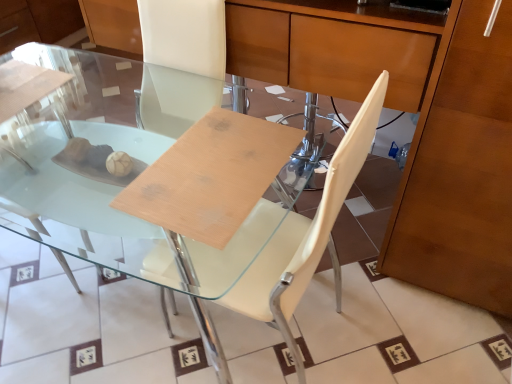
Question: Can you confirm if white leather chair at center is shorter than transparent glass table at center?

Choices:
 (A) yes
 (B) no

Answer: (B)

Question: Does white leather chair at center have a larger size compared to transparent glass table at center?

Choices:
 (A) no
 (B) yes

Answer: (A)

Question: Are white leather chair at center and transparent glass table at center making contact?

Choices:
 (A) no
 (B) yes

Answer: (A)

Question: From the image's perspective, is white leather chair at center over transparent glass table at center?

Choices:
 (A) no
 (B) yes

Answer: (A)

Question: Are white leather chair at center and transparent glass table at center located far from each other?

Choices:
 (A) yes
 (B) no

Answer: (B)

Question: Can you confirm if white leather chair at center is wider than transparent glass table at center?

Choices:
 (A) no
 (B) yes

Answer: (A)

Question: Is transparent glass table at center positioned with its back to white leather chair at center?

Choices:
 (A) yes
 (B) no

Answer: (A)

Question: Can you confirm if transparent glass table at center is taller than white leather chair at center?

Choices:
 (A) yes
 (B) no

Answer: (B)

Question: From the image's perspective, is transparent glass table at center above white leather chair at center?

Choices:
 (A) no
 (B) yes

Answer: (B)

Question: Is transparent glass table at center positioned in front of white leather chair at center?

Choices:
 (A) no
 (B) yes

Answer: (A)

Question: Considering the relative sizes of transparent glass table at center and white leather chair at center in the image provided, is transparent glass table at center smaller than white leather chair at center?

Choices:
 (A) no
 (B) yes

Answer: (A)

Question: Does transparent glass table at center turn towards white leather chair at center?

Choices:
 (A) yes
 (B) no

Answer: (B)

Question: Considering their positions, is transparent glass table at center located in front of or behind white leather chair at center?

Choices:
 (A) behind
 (B) front

Answer: (A)